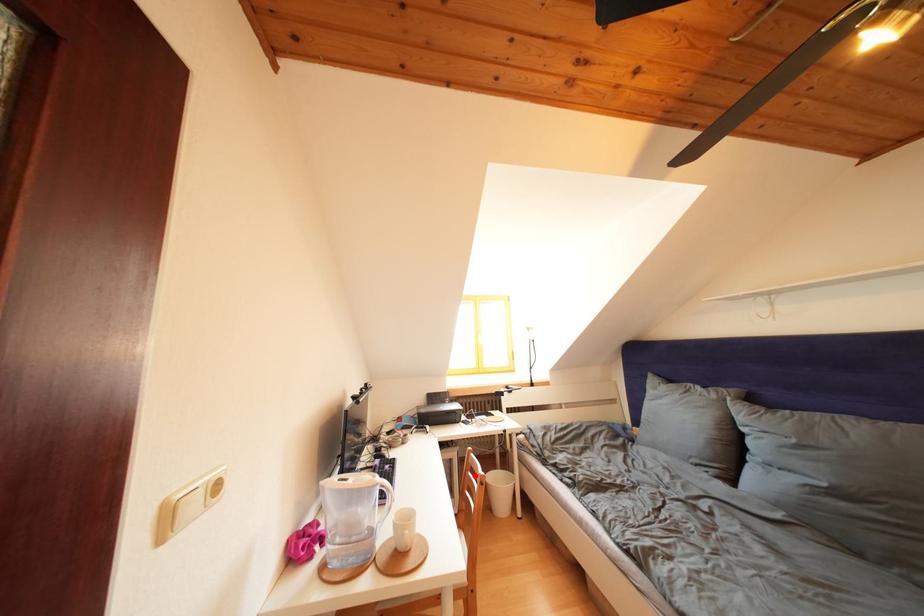
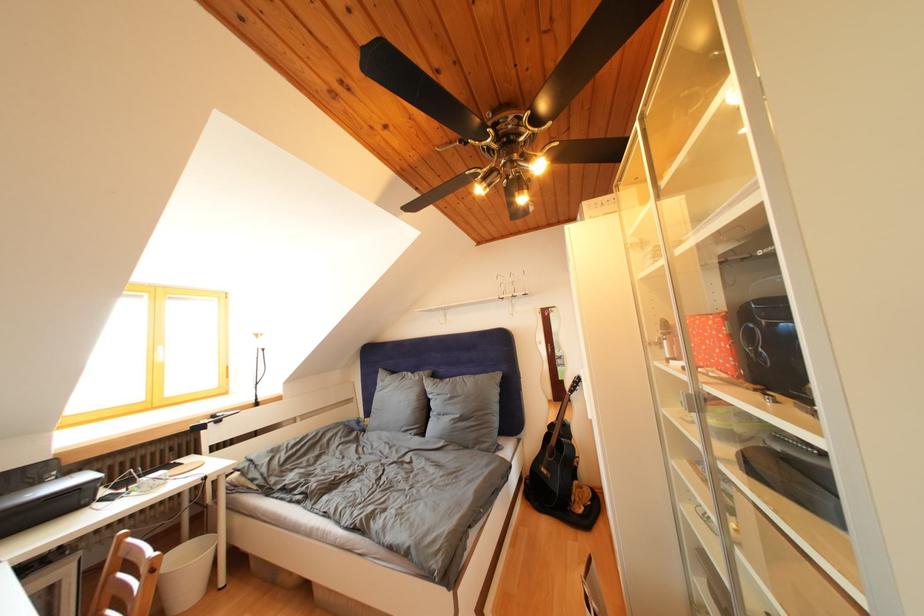
In the second image, find the point that corresponds to the highlighted location in the first image.

(119, 578)